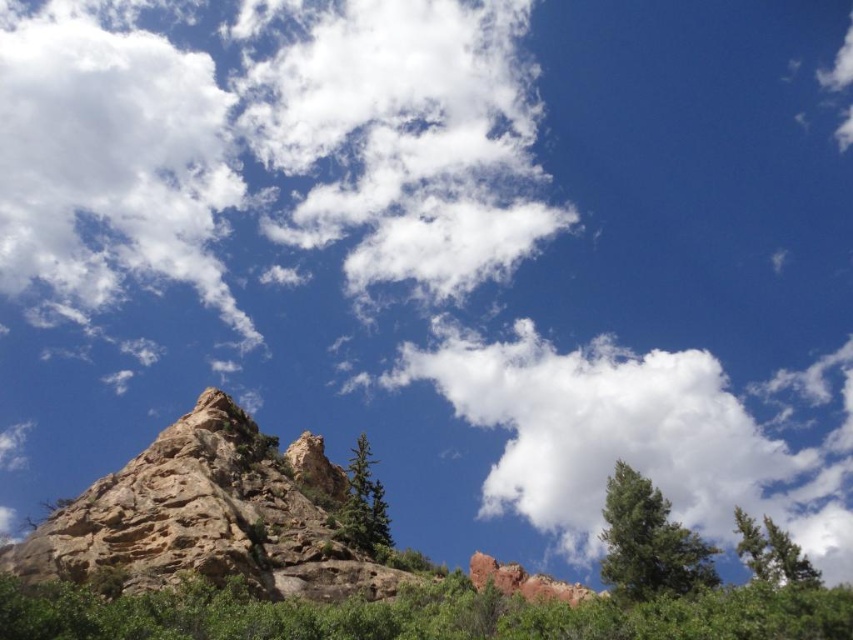
You are planning to build a hiking trail that must pass between the rugged stone mountain at center and the green matte tree at lower right. The trail requires a minimum width of 3 meters to accommodate hikers. Based on the scene, can the space between these two objects accommodate the trail?

The rugged stone mountain at center is narrower than the green matte tree at lower right. However, the description only states their widths relative to each other, not their absolute measurements. Without knowing the actual width of either object, it is impossible to determine if the space between them meets the 3 meter requirement for the trail.

Based on the photo, you are standing at the origin point in the image. Which direction should you move to reach the rugged stone mountain at center?

The rugged stone mountain at center is located at coordinates approximately 0.808 on the x axis and 0.246 on the y axis, so you should move northeast to reach it.